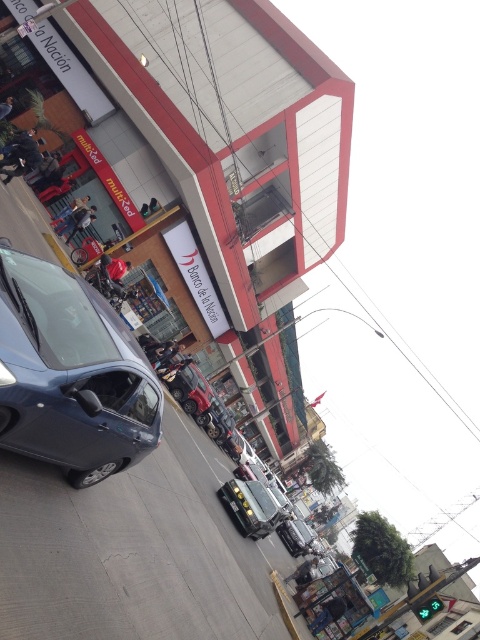
Does point (159, 394) come behind point (240, 504)?

No, it is not.

Can you confirm if metallic gray car at left is positioned below metallic silver car at center?

Actually, metallic gray car at left is above metallic silver car at center.

Which is behind, point (44, 401) or point (235, 508)?

Positioned behind is point (235, 508).

Image resolution: width=480 pixels, height=640 pixels. In order to click on metallic gray car at left in this screenshot , I will do `click(71, 372)`.